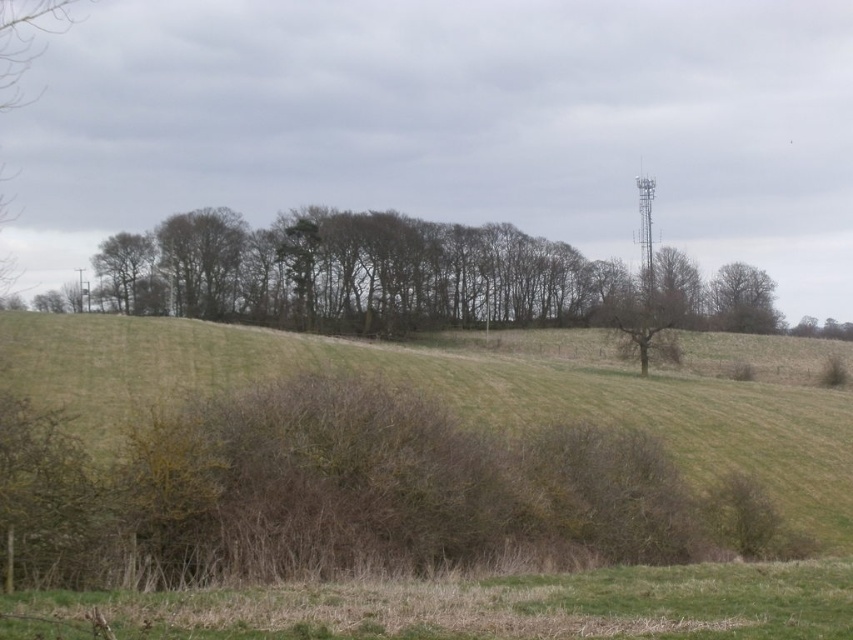
Between green grassy hillside at center and brown textured tree at upper right, which one appears on the right side from the viewer's perspective?

brown textured tree at upper right is more to the right.

Between green grassy hillside at center and brown textured tree at upper right, which one has less height?

Standing shorter between the two is green grassy hillside at center.

Between point (283, 348) and point (761, 324), which one is positioned behind?

Point (761, 324)

Locate an element on the screen. The width and height of the screenshot is (853, 640). green grassy hillside at center is located at coordinates (482, 390).

Can you confirm if brown textured tree at upper right is shorter than green leafy tree at upper left?

No, brown textured tree at upper right is not shorter than green leafy tree at upper left.

Is brown textured tree at upper right wider than green leafy tree at upper left?

Yes.

Where is `brown textured tree at upper right`? The height and width of the screenshot is (640, 853). brown textured tree at upper right is located at coordinates (741, 300).

Between point (764, 349) and point (134, 241), which one is positioned in front?

Point (764, 349) is more forward.

Is the position of green grassy hillside at center more distant than that of green leafy tree at upper left?

No.

Image resolution: width=853 pixels, height=640 pixels. I want to click on green grassy hillside at center, so click(x=482, y=390).